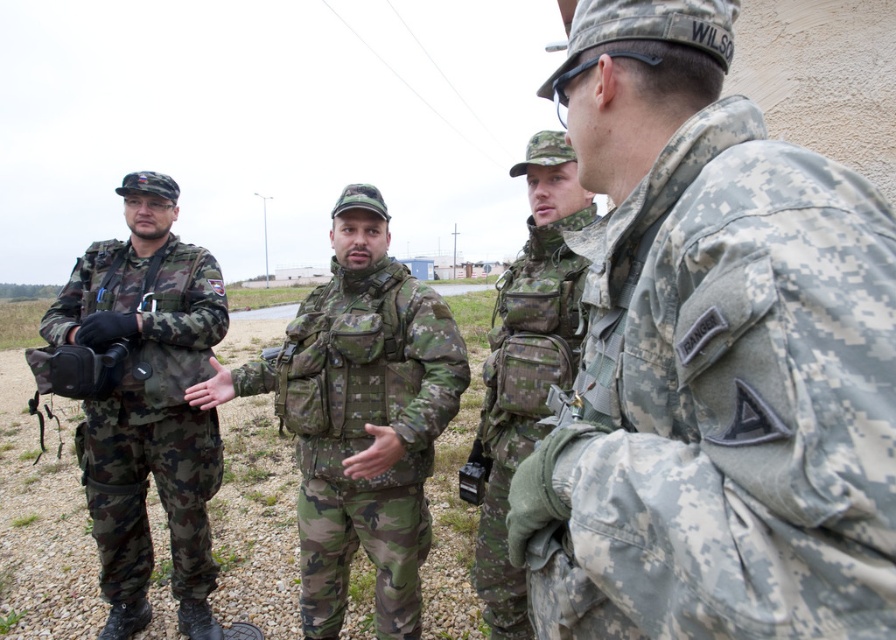
Question: Among these points, which one is nearest to the camera?

Choices:
 (A) (481, 570)
 (B) (342, 426)
 (C) (685, 304)

Answer: (C)

Question: Where is camouflage fabric uniform at center located in relation to camouflage fabric uniform at left in the image?

Choices:
 (A) right
 (B) left

Answer: (A)

Question: Which point is closer to the camera?

Choices:
 (A) (730, 161)
 (B) (558, 317)
 (C) (134, 412)

Answer: (A)

Question: Which point is closer to the camera?

Choices:
 (A) camouflage fabric uniform at left
 (B) camouflage fabric uniform at center
 (C) camouflage fabric vest at center
 (D) camouflage fabric jacket at center

Answer: (D)

Question: Is camouflage fabric jacket at center bigger than camouflage fabric uniform at center?

Choices:
 (A) no
 (B) yes

Answer: (A)

Question: Can you confirm if camouflage fabric jacket at center is bigger than camouflage fabric uniform at center?

Choices:
 (A) yes
 (B) no

Answer: (B)